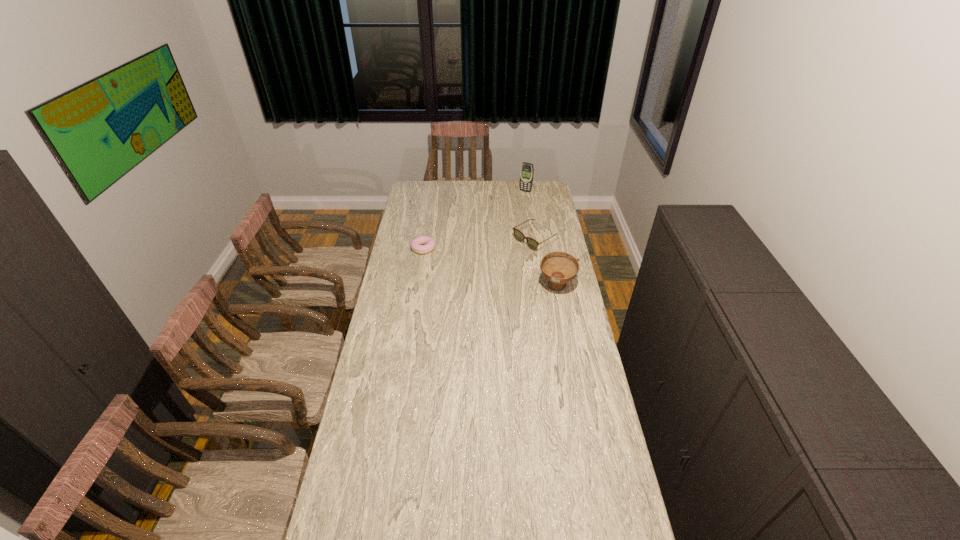
Locate an element on the screen. free region located 0.300m at the front view of the third tallest object is located at coordinates (476, 273).

Identify the location of free space located at the front view of the third tallest object. [505, 256].

Find the location of a particular element. The height and width of the screenshot is (540, 960). free region located 0.050m on the screen of the farthest object is located at coordinates (520, 197).

The width and height of the screenshot is (960, 540). Find the location of `vacant space located 0.260m on the screen of the farthest object`. vacant space located 0.260m on the screen of the farthest object is located at coordinates (509, 214).

This screenshot has width=960, height=540. I want to click on vacant space located 0.330m on the screen of the farthest object, so click(x=505, y=220).

Locate an element on the screen. This screenshot has height=540, width=960. object that is at the far edge is located at coordinates (527, 170).

Image resolution: width=960 pixels, height=540 pixels. Find the location of `object located at the left edge`. object located at the left edge is located at coordinates (423, 244).

Locate an element on the screen. soup bowl that is positioned at the right edge is located at coordinates (559, 268).

Identify the location of spectacles positioned at the right edge. (519, 236).

Locate an element on the screen. The image size is (960, 540). cellular telephone at the right edge is located at coordinates (527, 170).